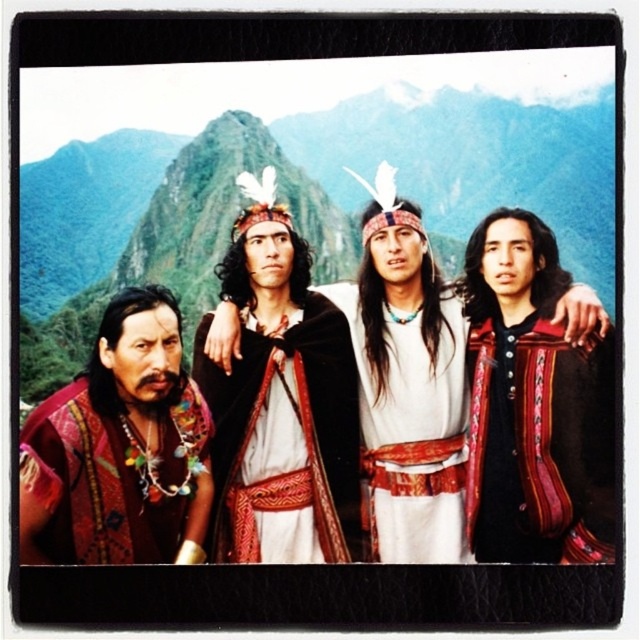
Question: Does textured wool shawl at right have a greater width compared to textured red fabric at left?

Choices:
 (A) no
 (B) yes

Answer: (A)

Question: From the image, what is the correct spatial relationship of matte black cape at center in relation to black wool cape at center?

Choices:
 (A) left
 (B) right

Answer: (B)

Question: Which object appears farthest from the camera in this image?

Choices:
 (A) matte black cape at center
 (B) white cotton shirt at center
 (C) green grassy mountain at center

Answer: (A)

Question: Which of the following is the closest to the observer?

Choices:
 (A) green grassy mountain at center
 (B) black wool cape at center
 (C) matte black cape at center

Answer: (A)

Question: Which object is closer to the camera taking this photo?

Choices:
 (A) green grassy mountain at center
 (B) matte black cape at center

Answer: (A)

Question: Can you confirm if green grassy mountain at center is positioned below matte black cape at center?

Choices:
 (A) no
 (B) yes

Answer: (A)